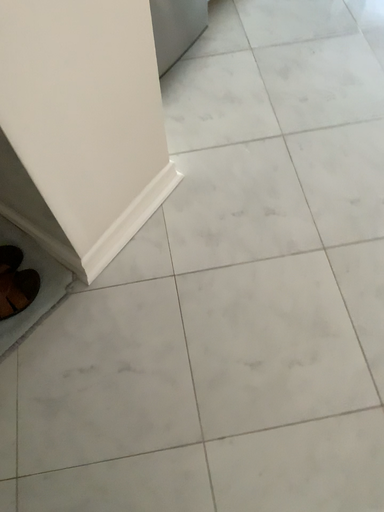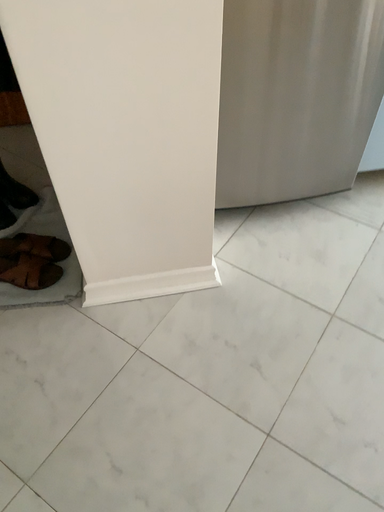
Question: Which way did the camera rotate in the video?

Choices:
 (A) rotated right
 (B) rotated left

Answer: (B)